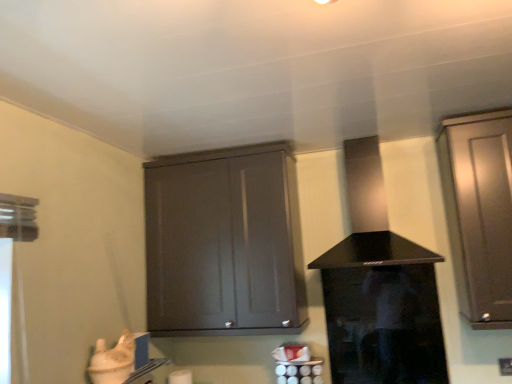
Question: From the image's perspective, is matte gray cabinet at center, the second cabinetry from the right, located above black glass vent at center?

Choices:
 (A) no
 (B) yes

Answer: (A)

Question: Can you confirm if matte gray cabinet at center, the second cabinetry from the right, is smaller than black glass vent at center?

Choices:
 (A) no
 (B) yes

Answer: (A)

Question: Could black glass vent at center be considered to be inside matte gray cabinet at center, which appears as the first cabinetry when viewed from the left?

Choices:
 (A) yes
 (B) no

Answer: (B)

Question: Is matte gray cabinet at center, the second cabinetry from the right, at the right side of black glass vent at center?

Choices:
 (A) no
 (B) yes

Answer: (A)

Question: Can you confirm if matte gray cabinet at center, the second cabinetry from the right, is taller than black glass vent at center?

Choices:
 (A) yes
 (B) no

Answer: (A)

Question: From a real-world perspective, is satin brown cabinet at right, placed as the first cabinetry when sorted from right to left, positioned above or below matte gray cabinet at center, the second cabinetry from the right?

Choices:
 (A) below
 (B) above

Answer: (B)

Question: Considering the positions of satin brown cabinet at right, placed as the first cabinetry when sorted from right to left, and matte gray cabinet at center, which appears as the first cabinetry when viewed from the left, in the image, is satin brown cabinet at right, placed as the first cabinetry when sorted from right to left, wider or thinner than matte gray cabinet at center, which appears as the first cabinetry when viewed from the left,?

Choices:
 (A) wide
 (B) thin

Answer: (A)

Question: Is satin brown cabinet at right, the second cabinetry in the left-to-right sequence, taller or shorter than matte gray cabinet at center, which appears as the first cabinetry when viewed from the left?

Choices:
 (A) short
 (B) tall

Answer: (B)

Question: From the image's perspective, is satin brown cabinet at right, placed as the first cabinetry when sorted from right to left, above or below matte gray cabinet at center, the second cabinetry from the right?

Choices:
 (A) below
 (B) above

Answer: (B)

Question: Looking at their shapes, would you say transparent glass screen door at center is wider or thinner than black glass vent at center?

Choices:
 (A) wide
 (B) thin

Answer: (B)

Question: Considering the positions of point (438, 331) and point (360, 233), is point (438, 331) closer or farther from the camera than point (360, 233)?

Choices:
 (A) farther
 (B) closer

Answer: (A)

Question: From a real-world perspective, is transparent glass screen door at center physically located above or below black glass vent at center?

Choices:
 (A) above
 (B) below

Answer: (B)

Question: Looking at the image, does transparent glass screen door at center seem bigger or smaller compared to black glass vent at center?

Choices:
 (A) big
 (B) small

Answer: (B)

Question: From a real-world perspective, is satin brown cabinet at right, placed as the first cabinetry when sorted from right to left, positioned above or below transparent glass screen door at center?

Choices:
 (A) above
 (B) below

Answer: (A)

Question: In terms of height, does satin brown cabinet at right, placed as the first cabinetry when sorted from right to left, look taller or shorter compared to transparent glass screen door at center?

Choices:
 (A) short
 (B) tall

Answer: (B)